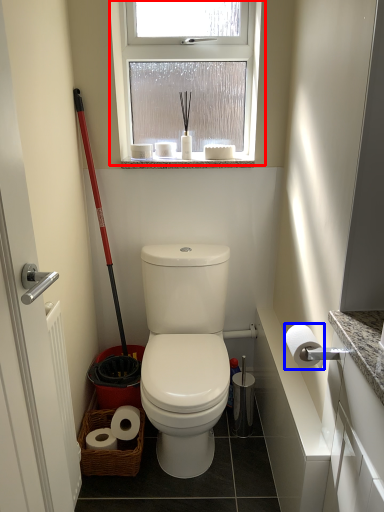
Question: Which object appears closest to the camera in this image, window (highlighted by a red box) or toilet paper (highlighted by a blue box)?

Choices:
 (A) window
 (B) toilet paper

Answer: (B)